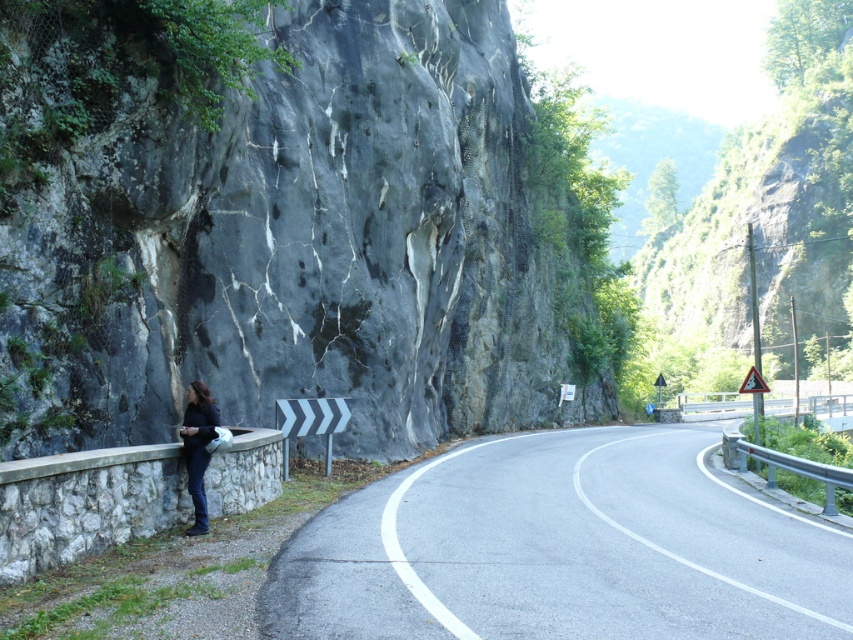
You are driving along the black asphalt road at center and need to cross over to the area near the metallic gray barrier at right. Is the road above or below the barrier?

The black asphalt road at center is above the metallic gray barrier at right, so you would need to go down to reach the barrier area.

You are driving along the black asphalt road at center and see the dark blue jeans at left. Which object takes up more space in the image?

The black asphalt road at center takes up more space in the image as it is bigger than the dark blue jeans at left.

In the scene shown: You are standing at the point labeled as point (561,548) in the image. Which object are you currently standing on?

You are standing on the black asphalt road at center.